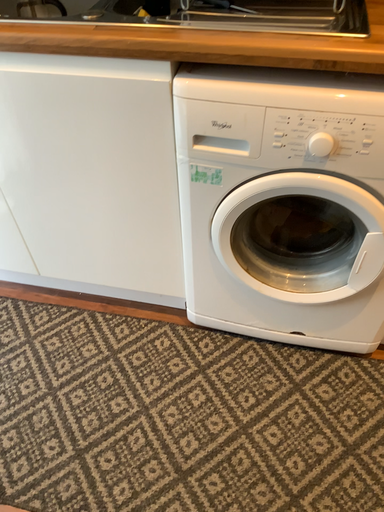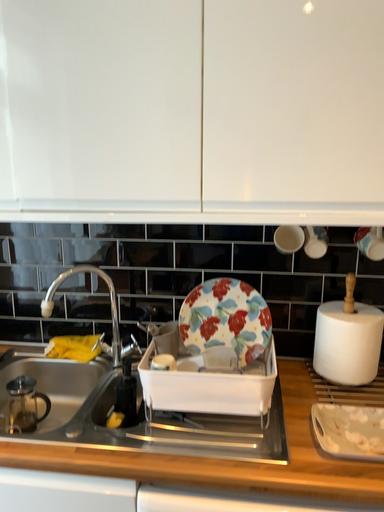
Question: How did the camera likely rotate when shooting the video?

Choices:
 (A) rotated downward
 (B) rotated upward

Answer: (B)